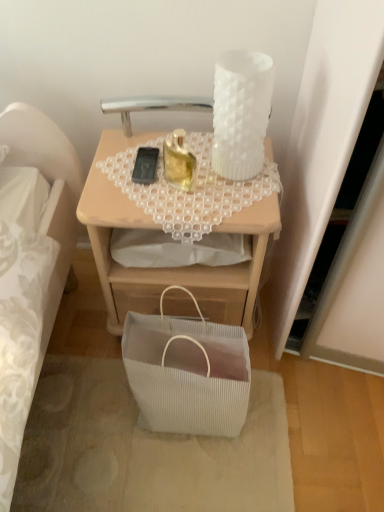
Where is `vacant area to the right of translucent glass candle at upper center, arranged as the second candle holder when viewed from the right`? This screenshot has height=512, width=384. vacant area to the right of translucent glass candle at upper center, arranged as the second candle holder when viewed from the right is located at coordinates (235, 184).